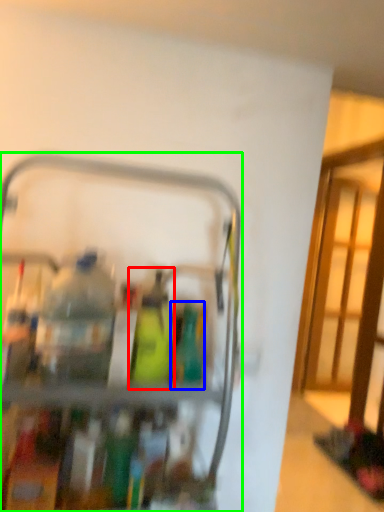
Question: Which object is the closest to the bottle (highlighted by a red box)? Choose among these: bottle (highlighted by a blue box) or appliance (highlighted by a green box).

Choices:
 (A) bottle
 (B) appliance

Answer: (A)